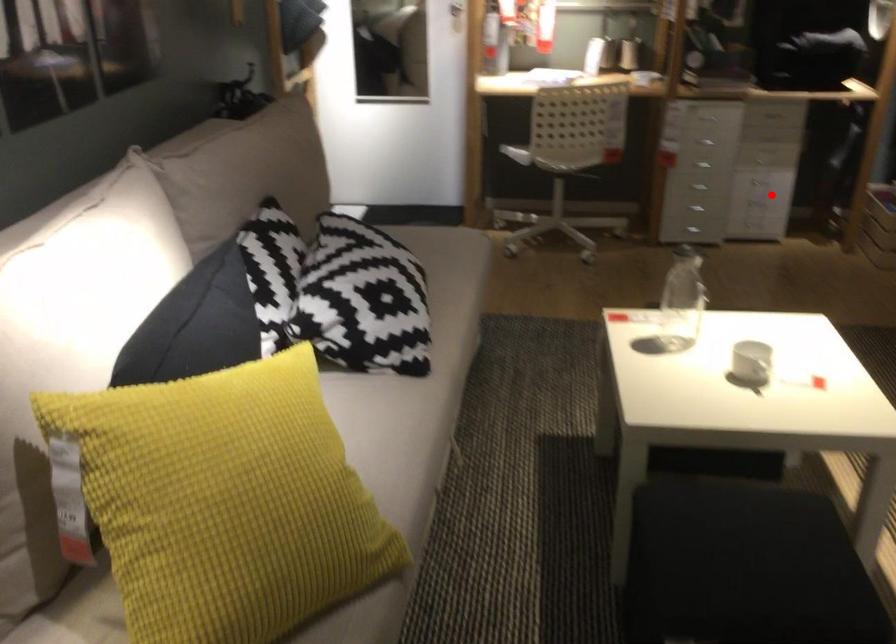
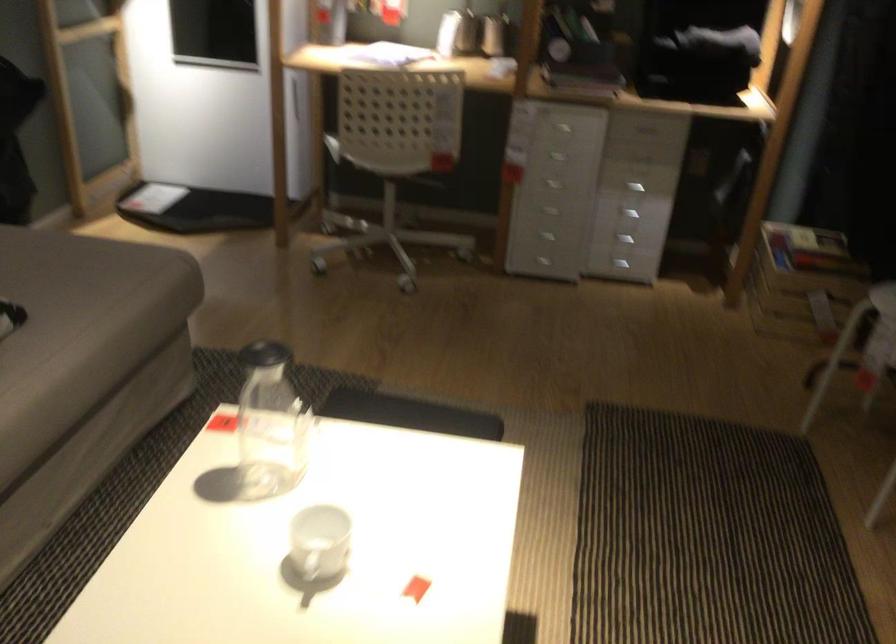
Where in the second image is the point corresponding to the highlighted location from the first image?

(625, 240)